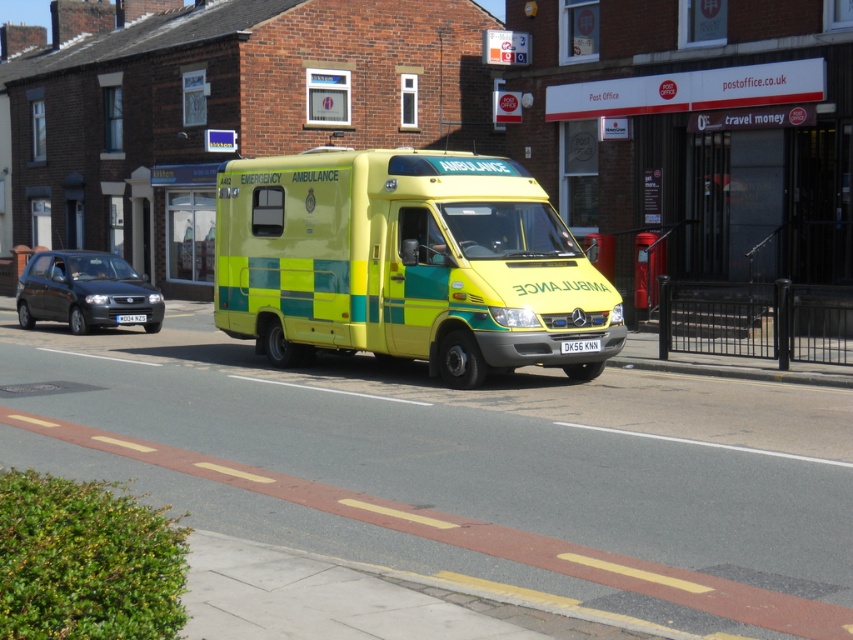
Question: Which of the following is the farthest from the observer?

Choices:
 (A) (119, 316)
 (B) (91, 275)
 (C) (566, 342)
 (D) (440, 152)

Answer: (B)

Question: Observing the image, what is the correct spatial positioning of matte black car at left in reference to black plastic license plate at center?

Choices:
 (A) below
 (B) above

Answer: (B)

Question: Which of these objects is positioned farthest from the black plastic license plate at center?

Choices:
 (A) matte black car at left
 (B) yellow/green checkered ambulance at center
 (C) white plastic license plate at center

Answer: (A)

Question: Is matte black car at left thinner than black plastic license plate at center?

Choices:
 (A) no
 (B) yes

Answer: (A)

Question: Does yellow/green checkered ambulance at center come behind black plastic license plate at center?

Choices:
 (A) yes
 (B) no

Answer: (A)

Question: Which point appears farthest from the camera in this image?

Choices:
 (A) (422, 252)
 (B) (137, 321)
 (C) (25, 305)
 (D) (583, 342)

Answer: (C)